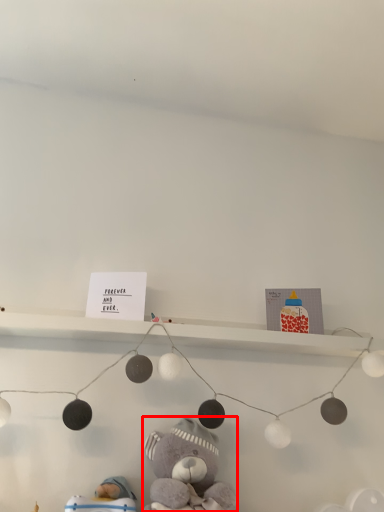
Question: From the image, what is the correct spatial relationship of teddy bear (annotated by the red box) in relation to toy?

Choices:
 (A) left
 (B) right

Answer: (B)